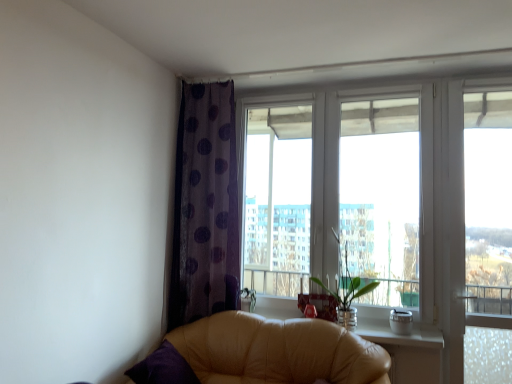
What are the coordinates of `transparent glass window at center` in the screenshot? It's located at (381, 191).

This screenshot has width=512, height=384. What do you see at coordinates (277, 351) in the screenshot?
I see `leather couch at lower left` at bounding box center [277, 351].

You are a GUI agent. You are given a task and a screenshot of the screen. Output one action in this format:
    pyautogui.click(x=<x>, y=<y>)
    Task: Click on the green glass vase at center
    This screenshot has height=384, width=512.
    Given the screenshot: What is the action you would take?
    pyautogui.click(x=347, y=290)

Considering the positions of points (213, 161) and (304, 205), is point (213, 161) closer to camera compared to point (304, 205)?

Yes, it is.

Would you say purple dotted curtain at left is inside or outside transparent glass window at center?

The correct answer is: outside.

Can you confirm if purple dotted curtain at left is smaller than transparent glass window at center?

Correct, purple dotted curtain at left occupies less space than transparent glass window at center.

Is purple dotted curtain at left far from transparent glass window at center?

purple dotted curtain at left is near transparent glass window at center, not far away.

Does point (484, 181) come in front of point (238, 279)?

Yes, point (484, 181) is closer to viewer.

Is transparent plastic screen at right further to the viewer compared to purple dotted curtain at left?

No, transparent plastic screen at right is closer to the viewer.

This screenshot has height=384, width=512. I want to click on window screen lying below the purple dotted curtain at left (from the image's perspective), so click(488, 201).

Measure the distance from transparent plastic screen at right to purple dotted curtain at left.

They are 1.67 meters apart.

From a real-world perspective, which object stands above the other?

transparent plastic screen at right.

Between transparent plastic screen at right and green glass vase at center, which one is positioned in front?

transparent plastic screen at right is more forward.

Which of these two, transparent plastic screen at right or green glass vase at center, is smaller?

transparent plastic screen at right is smaller.

Considering the sizes of objects green glass vase at center and purple dotted curtain at left in the image provided, who is bigger, green glass vase at center or purple dotted curtain at left?

purple dotted curtain at left is bigger.

From the image's perspective, would you say green glass vase at center is positioned over purple dotted curtain at left?

Incorrect, from the image's perspective, green glass vase at center is lower than purple dotted curtain at left.

Consider the image. In terms of height, does green glass vase at center look taller or shorter compared to purple dotted curtain at left?

green glass vase at center is shorter than purple dotted curtain at left.

Between leather couch at lower left and green glass vase at center, which one has smaller size?

green glass vase at center is smaller.

Between point (307, 353) and point (314, 278), which one is positioned behind?

Point (314, 278)

Does leather couch at lower left have a lesser height compared to green glass vase at center?

Yes.

In the image, is leather couch at lower left positioned in front of or behind green glass vase at center?

leather couch at lower left is positioned closer to the viewer than green glass vase at center.

In the scene shown: Does transparent plastic screen at right have a lesser width compared to transparent glass window at center?

Yes.

From the image's perspective, is transparent plastic screen at right on transparent glass window at center?

Actually, transparent plastic screen at right appears below transparent glass window at center in the image.

Which of these two, transparent plastic screen at right or transparent glass window at center, stands taller?

Standing taller between the two is transparent plastic screen at right.

From a real-world perspective, relative to transparent glass window at center, is transparent plastic screen at right vertically above or below?

transparent plastic screen at right is below transparent glass window at center.

How far apart are transparent glass window at center and leather couch at lower left?

transparent glass window at center and leather couch at lower left are 32.64 inches apart from each other.

Identify the location of window that is above the leather couch at lower left (from a real-world perspective). The width and height of the screenshot is (512, 384). (381, 191).

Is the surface of transparent glass window at center in direct contact with leather couch at lower left?

Answer: No.

From a real-world perspective, is transparent glass window at center physically above leather couch at lower left?

Yes.

Locate an element on the screen. curtain that is below the transparent glass window at center (from the image's perspective) is located at coordinates (205, 206).

Identify the location of curtain above the transparent plastic screen at right (from the image's perspective). (205, 206).

When comparing their distances from transparent glass window at center, does purple dotted curtain at left or transparent plastic screen at right seem further?

purple dotted curtain at left.

Looking at the image, which one is located closer to transparent plastic screen at right, purple dotted curtain at left or transparent glass window at center?

The object closer to transparent plastic screen at right is transparent glass window at center.

Which object lies further to the anchor point leather couch at lower left, green glass vase at center or purple dotted curtain at left?

purple dotted curtain at left is positioned further to the anchor leather couch at lower left.

When comparing their distances from transparent plastic screen at right, does leather couch at lower left or purple dotted curtain at left seem closer?

leather couch at lower left is closer to transparent plastic screen at right.

Which object lies further to the anchor point green glass vase at center, transparent glass window at center or transparent plastic screen at right?

transparent plastic screen at right is positioned further to the anchor green glass vase at center.

Based on their spatial positions, is leather couch at lower left or transparent glass window at center further from green glass vase at center?

Based on the image, leather couch at lower left appears to be further to green glass vase at center.

Based on their spatial positions, is leather couch at lower left or green glass vase at center closer to purple dotted curtain at left?

Among the two, leather couch at lower left is located nearer to purple dotted curtain at left.

Looking at the image, which one is located further to purple dotted curtain at left, transparent glass window at center or transparent plastic screen at right?

transparent plastic screen at right.

Where is `plant located between purple dotted curtain at left and transparent plastic screen at right in the left-right direction`? plant located between purple dotted curtain at left and transparent plastic screen at right in the left-right direction is located at coordinates (347, 290).

The width and height of the screenshot is (512, 384). Find the location of `plant located between transparent glass window at center and transparent plastic screen at right in the left-right direction`. plant located between transparent glass window at center and transparent plastic screen at right in the left-right direction is located at coordinates (347, 290).

Identify the location of window between leather couch at lower left and transparent plastic screen at right. Image resolution: width=512 pixels, height=384 pixels. (381, 191).

Where is `plant situated between leather couch at lower left and transparent plastic screen at right from left to right`? The height and width of the screenshot is (384, 512). plant situated between leather couch at lower left and transparent plastic screen at right from left to right is located at coordinates [x=347, y=290].